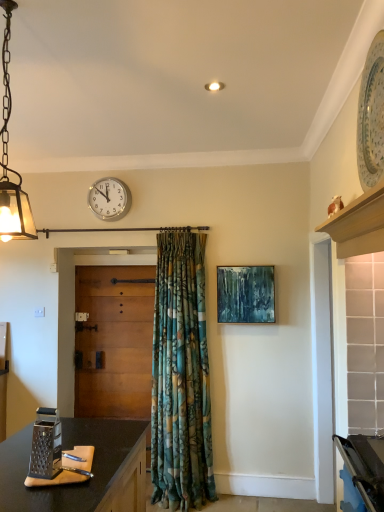
Question: From a real-world perspective, is teal textured canvas at center below white plastic wall clock at upper center?

Choices:
 (A) no
 (B) yes

Answer: (B)

Question: Can white plastic wall clock at upper center be found inside teal textured canvas at center?

Choices:
 (A) no
 (B) yes

Answer: (A)

Question: Is teal textured canvas at center to the right of white plastic wall clock at upper center from the viewer's perspective?

Choices:
 (A) yes
 (B) no

Answer: (A)

Question: Does teal textured canvas at center appear on the left side of white plastic wall clock at upper center?

Choices:
 (A) no
 (B) yes

Answer: (A)

Question: Is teal textured canvas at center oriented towards white plastic wall clock at upper center?

Choices:
 (A) yes
 (B) no

Answer: (B)

Question: Is matte glass pendant light at left in front of or behind teal textured canvas at center in the image?

Choices:
 (A) behind
 (B) front

Answer: (B)

Question: Looking at their shapes, would you say matte glass pendant light at left is wider or thinner than teal textured canvas at center?

Choices:
 (A) thin
 (B) wide

Answer: (B)

Question: Looking at the image, does matte glass pendant light at left seem bigger or smaller compared to teal textured canvas at center?

Choices:
 (A) big
 (B) small

Answer: (A)

Question: Does point (19, 238) appear closer or farther from the camera than point (221, 278)?

Choices:
 (A) closer
 (B) farther

Answer: (B)

Question: Looking at their shapes, would you say metallic grater at lower left is wider or thinner than wooden door at center?

Choices:
 (A) wide
 (B) thin

Answer: (A)

Question: Considering the positions of metallic grater at lower left and wooden door at center in the image, is metallic grater at lower left taller or shorter than wooden door at center?

Choices:
 (A) short
 (B) tall

Answer: (A)

Question: Considering the positions of point (59, 444) and point (132, 359), is point (59, 444) closer or farther from the camera than point (132, 359)?

Choices:
 (A) closer
 (B) farther

Answer: (A)

Question: Would you say metallic grater at lower left is to the left or to the right of wooden door at center in the picture?

Choices:
 (A) left
 (B) right

Answer: (B)

Question: Considering the positions of wooden door at center and matte glass pendant light at left in the image, is wooden door at center taller or shorter than matte glass pendant light at left?

Choices:
 (A) short
 (B) tall

Answer: (B)

Question: Considering the positions of point (145, 365) and point (9, 209), is point (145, 365) closer or farther from the camera than point (9, 209)?

Choices:
 (A) farther
 (B) closer

Answer: (A)